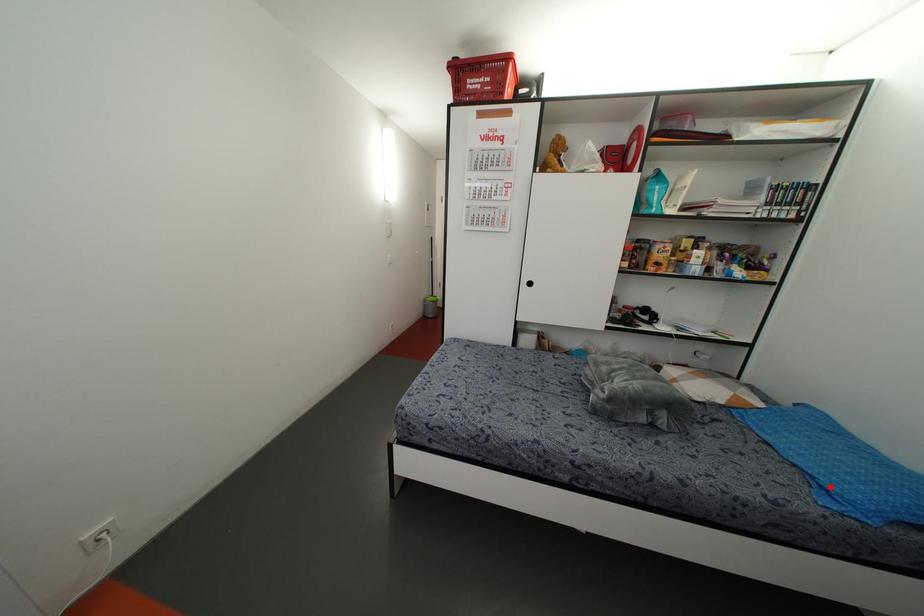
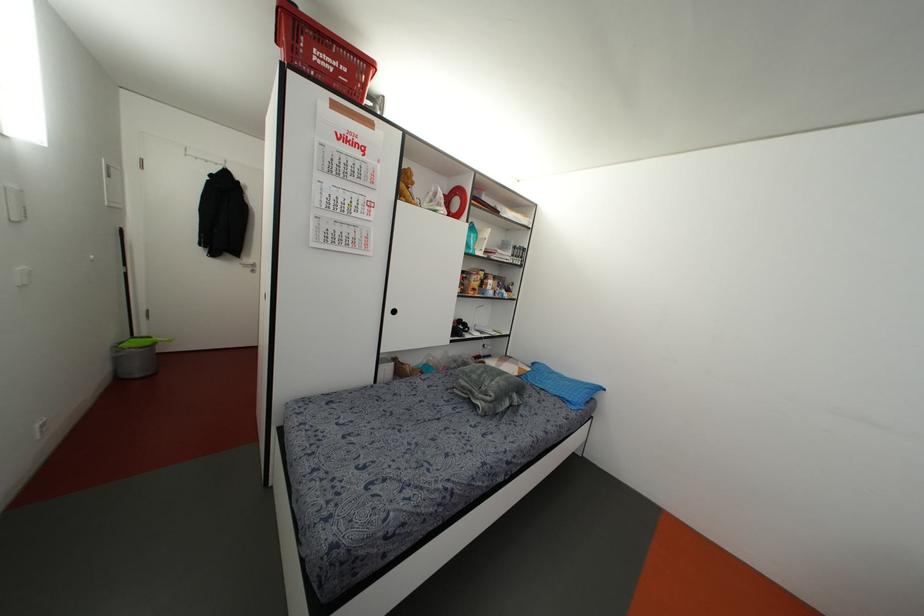
Where in the second image is the point corresponding to the highlighted location from the first image?

(569, 399)